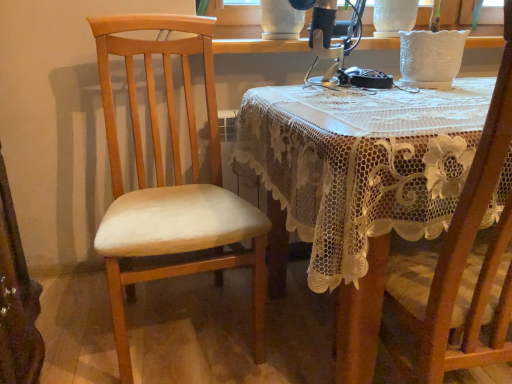
Where is `free space to the left of light wood chair at left, the 1th chair viewed from the left`? The width and height of the screenshot is (512, 384). free space to the left of light wood chair at left, the 1th chair viewed from the left is located at coordinates (78, 319).